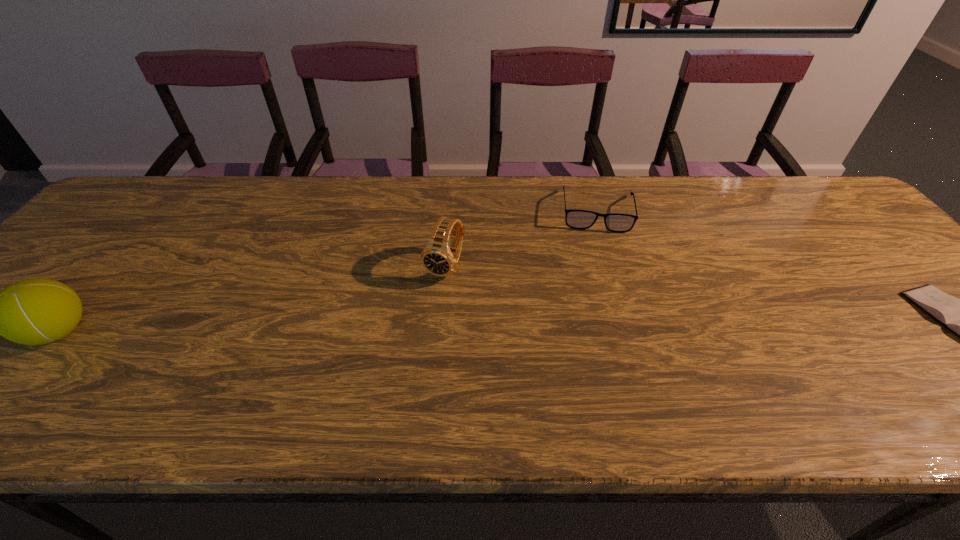
Identify the location of free location located on the face of the watch. (403, 353).

At what (x,y) coordinates should I click in order to perform the action: click on object located at the far edge. Please return your answer as a coordinate pair (x, y). This screenshot has height=540, width=960. Looking at the image, I should click on (577, 219).

You are a GUI agent. You are given a task and a screenshot of the screen. Output one action in this format:
    pyautogui.click(x=<x>, y=<y>)
    Task: Click on the object that is at the near edge
    The height and width of the screenshot is (540, 960).
    Given the screenshot: What is the action you would take?
    pyautogui.click(x=36, y=311)

Locate an element on the screen. The image size is (960, 540). object located in the left edge section of the desktop is located at coordinates (36, 311).

The image size is (960, 540). Identify the location of object situated at the near left corner. (36, 311).

The image size is (960, 540). In the image, there is a desktop. Find the location of `vacant space at the far edge`. vacant space at the far edge is located at coordinates (685, 182).

In the image, there is a desktop. Where is `vacant space at the near edge`? This screenshot has height=540, width=960. vacant space at the near edge is located at coordinates (346, 382).

The width and height of the screenshot is (960, 540). I want to click on free point at the left edge, so click(129, 240).

Where is `vacant space at the right edge`? This screenshot has height=540, width=960. vacant space at the right edge is located at coordinates (909, 347).

Locate an element on the screen. The image size is (960, 540). vacant space at the far left corner is located at coordinates (163, 195).